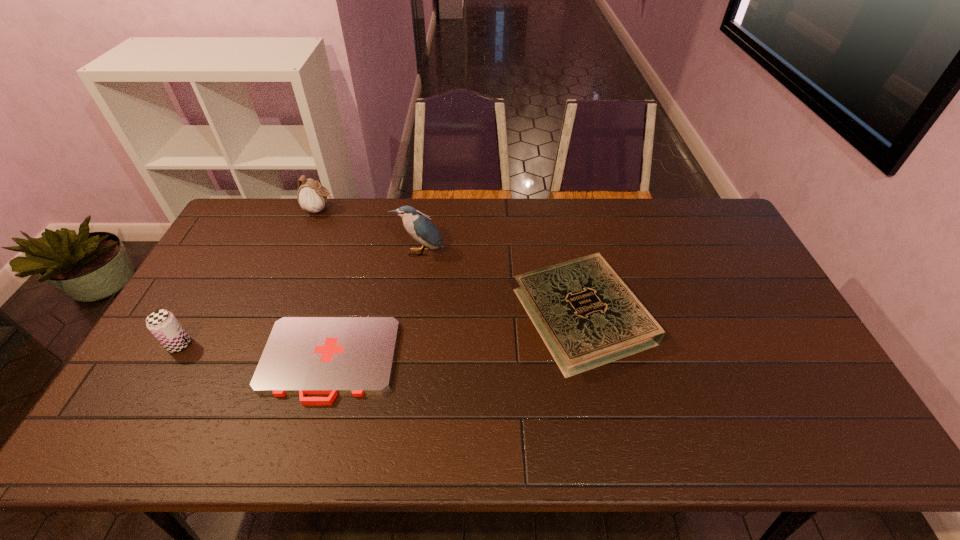
What are the coordinates of `free area in between the leftmost object and the shortest object` in the screenshot? It's located at (254, 353).

Find the location of a particular element. The width and height of the screenshot is (960, 540). vacant space that's between the leftmost object and the pouch is located at coordinates (250, 277).

Identify the location of vacant space in between the first-aid kit and the beer can. (254, 353).

Identify the location of free space between the shortest object and the pouch. The image size is (960, 540). (324, 285).

Where is `free spot between the fourth tallest object and the pouch`? The image size is (960, 540). free spot between the fourth tallest object and the pouch is located at coordinates (451, 262).

Where is `empty space between the hardback book and the tallest object`? empty space between the hardback book and the tallest object is located at coordinates 501,284.

Select which object appears as the closest to the pouch. Please provide its 2D coordinates. Your answer should be formatted as a tuple, i.e. [(x, y)], where the tuple contains the x and y coordinates of a point satisfying the conditions above.

[(420, 227)]

Select which object is the closest to the tallest object. Please provide its 2D coordinates. Your answer should be formatted as a tuple, i.e. [(x, y)], where the tuple contains the x and y coordinates of a point satisfying the conditions above.

[(586, 315)]

Find the location of a particular element. free spot that satisfies the following two spatial constraints: 1. on the back side of the rightmost object; 2. on the front-facing side of the farthest object is located at coordinates (561, 210).

The height and width of the screenshot is (540, 960). Find the location of `vacant space that satisfies the following two spatial constraints: 1. on the front-facing side of the pouch; 2. on the back side of the fourth tallest object`. vacant space that satisfies the following two spatial constraints: 1. on the front-facing side of the pouch; 2. on the back side of the fourth tallest object is located at coordinates (276, 316).